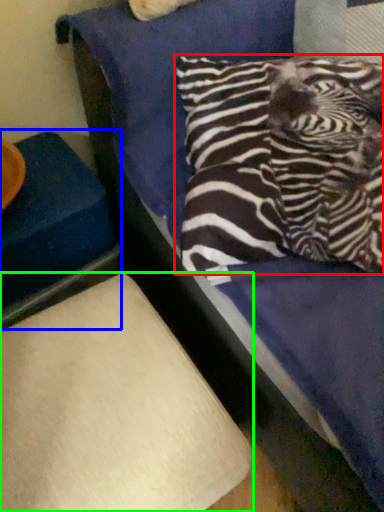
Question: Based on their relative distances, which object is nearer to pillow (highlighted by a red box)? Choose from furniture (highlighted by a blue box) and furniture (highlighted by a green box).

Choices:
 (A) furniture
 (B) furniture

Answer: (B)